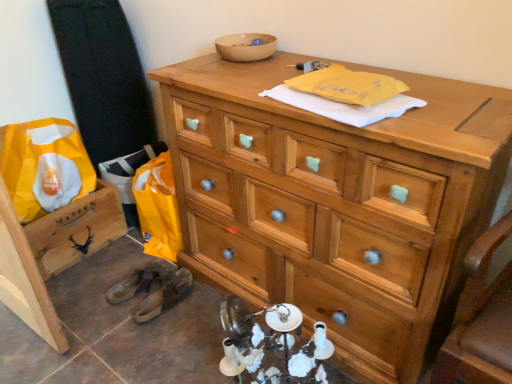
The height and width of the screenshot is (384, 512). In order to click on free space in front of brown leather shoe at lower left, the first shoe when ordered from right to left in this screenshot , I will do `click(156, 338)`.